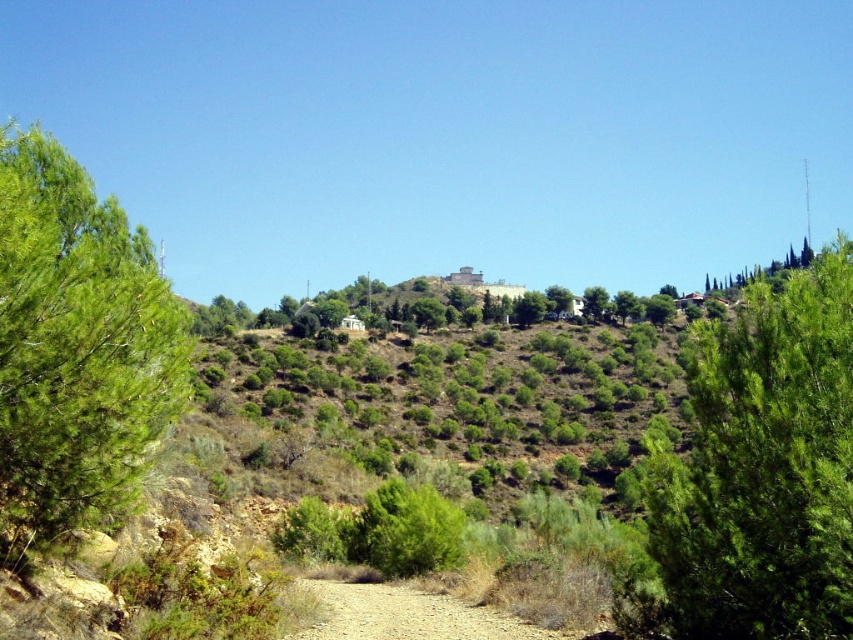
You are hiking along the dirt path and want to rest under a tree for shade. Is the green leafy tree at upper right located above the brown gravel path at center where you are walking?

The brown gravel path at center is positioned under the green leafy tree at upper right, so yes, the tree is above the path, providing potential shade.

Based on the photo, you are a hiker standing at the dirt path in the foreground. You notice a green leafy bush at upper right and a green leafy tree at upper right. Which one would you need to look up to see better?

The green leafy tree at upper right is taller than the green leafy bush at upper right, so you would need to look up to see the green leafy tree at upper right better.